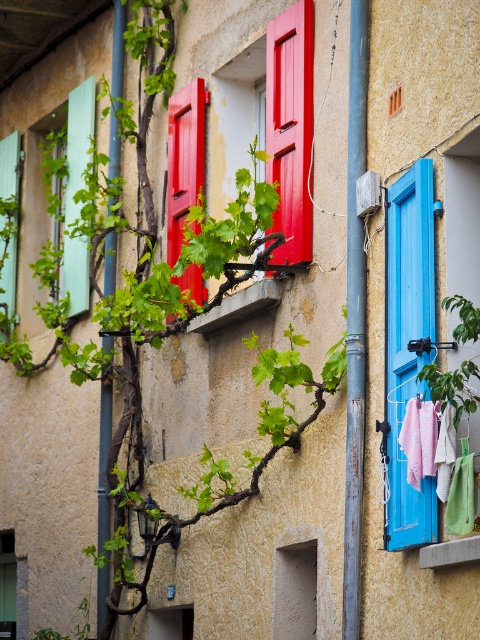
Question: Can you confirm if blue painted wood at right is smaller than metallic pipe at left?

Choices:
 (A) no
 (B) yes

Answer: (B)

Question: In this image, where is metallic pipe at center located relative to metallic pipe at left?

Choices:
 (A) below
 (B) above

Answer: (A)

Question: Which object appears farthest from the camera in this image?

Choices:
 (A) blue painted wood at right
 (B) metallic pipe at left
 (C) matte teal shutters at left
 (D) green fabric at right

Answer: (C)

Question: Does blue painted wood at right have a larger size compared to matte teal shutters at left?

Choices:
 (A) yes
 (B) no

Answer: (B)

Question: Based on their relative distances, which object is farther from the metallic pipe at center?

Choices:
 (A) matte teal shutters at left
 (B) green fabric at right
 (C) matte green shutters at left
 (D) blue painted wood at right

Answer: (A)

Question: Which object appears farthest from the camera in this image?

Choices:
 (A) green fabric at right
 (B) metallic pipe at left

Answer: (B)